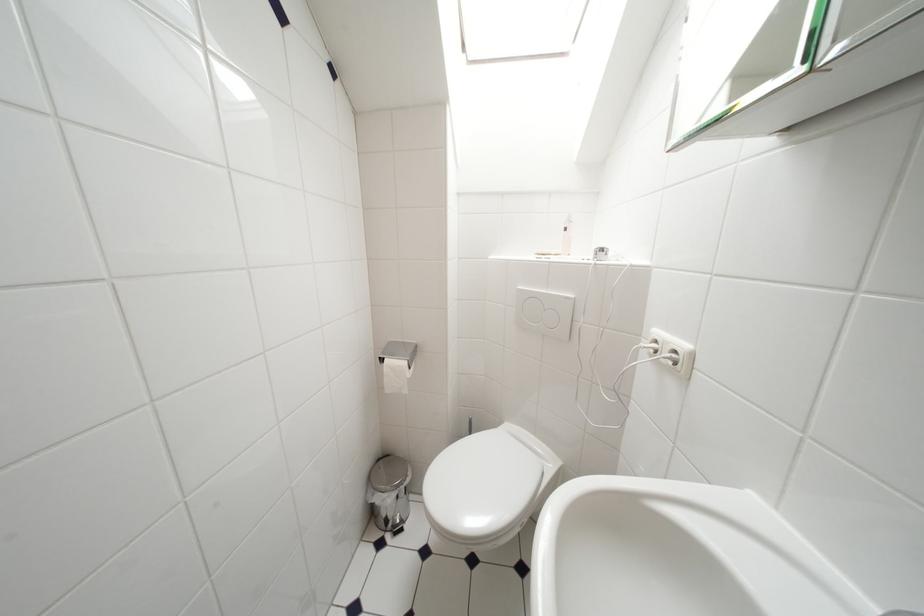
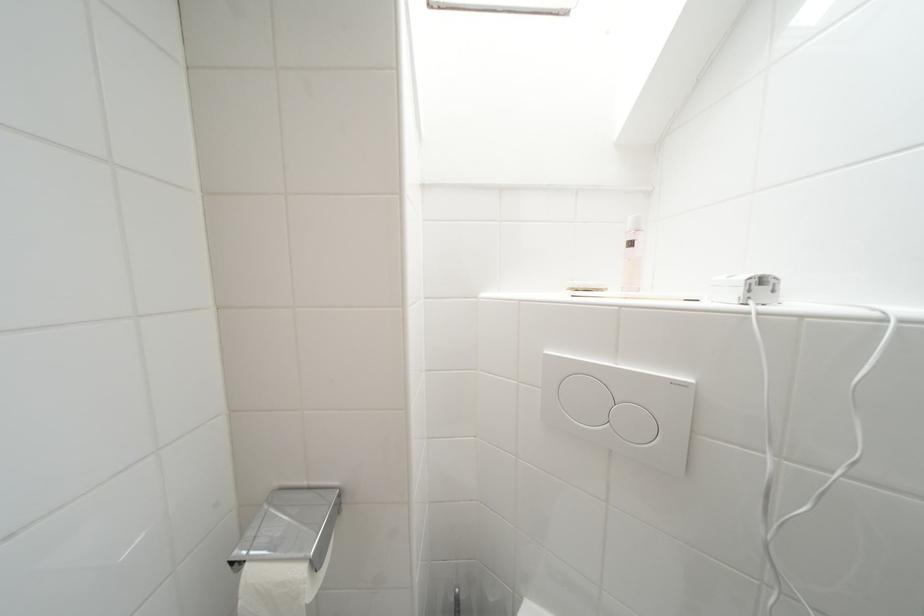
Question: Which direction would the cameraman need to move to produce the second image? Reply with the corresponding letter.

Choices:
 (A) Left
 (B) Right
 (C) Forward
 (D) Backward

Answer: (C)